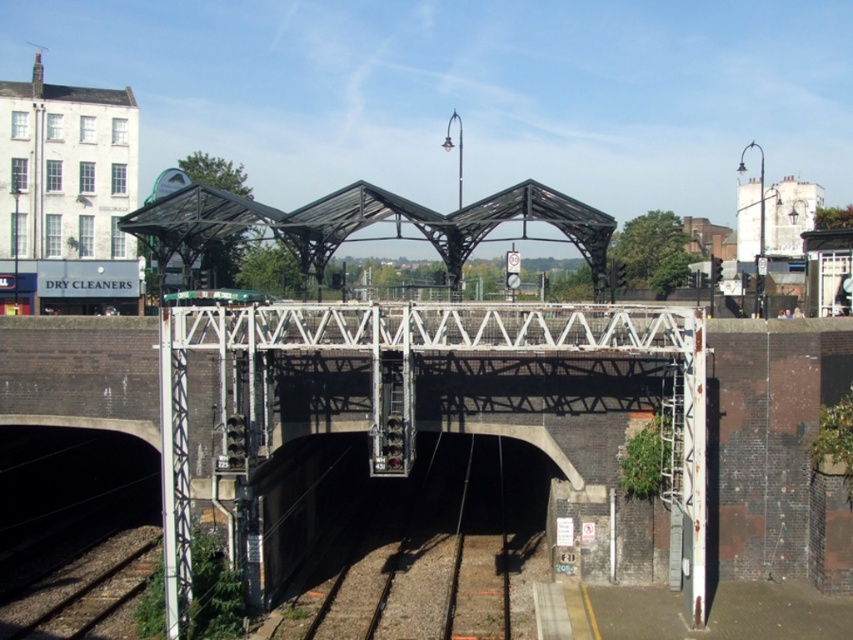
Question: Does metallic/glass roof at center appear on the right side of green matte train at center?

Choices:
 (A) no
 (B) yes

Answer: (B)

Question: Estimate the real-world distances between objects in this image. Which object is closer to the metallic/glass roof at center?

Choices:
 (A) black metal train track at center
 (B) green matte train at center

Answer: (B)

Question: Which of the following is the farthest from the observer?

Choices:
 (A) (434, 243)
 (B) (401, 515)
 (C) (193, 294)

Answer: (C)

Question: Can you confirm if metallic/glass roof at center is smaller than green matte train at center?

Choices:
 (A) yes
 (B) no

Answer: (B)

Question: Which point is farther to the camera?

Choices:
 (A) green matte train at center
 (B) metallic/glass roof at center
 (C) black metal train track at center

Answer: (B)

Question: Is black metal train track at center positioned behind green matte train at center?

Choices:
 (A) yes
 (B) no

Answer: (B)